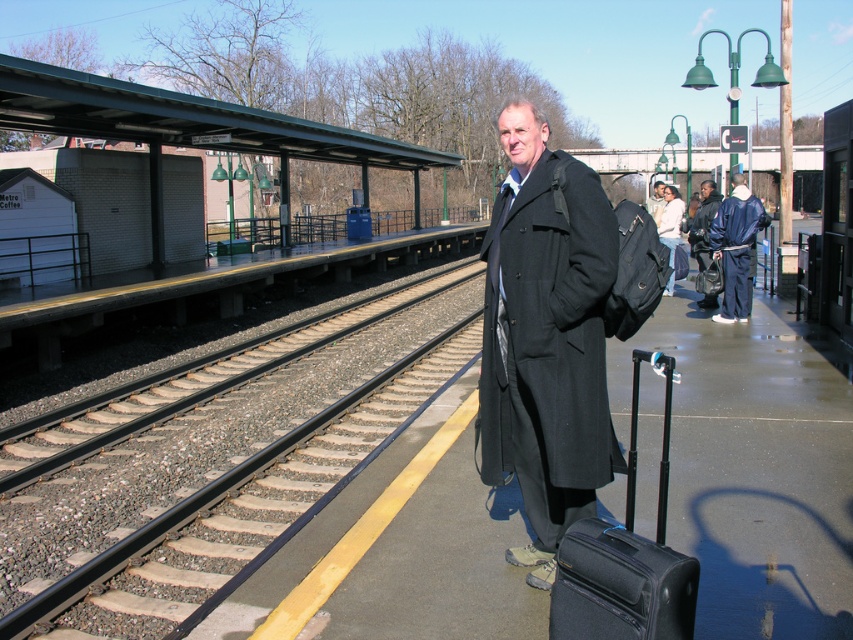
You are a photographer standing on the train station platform. You notice two people in the scene, one wearing a blue tracksuit at right and the other in a matte black coat at center. Which person appears taller in the photo?

The blue tracksuit at right is taller than the matte black coat at center, so the person in the blue tracksuit at right appears taller in the photo.

You are standing on the train station platform and notice a person wearing a blue tracksuit at right. Where exactly is this person positioned relative to the platform?

The blue tracksuit at right is located at point 0.386 on the horizontal axis and 0.863 on the vertical axis of the platform.